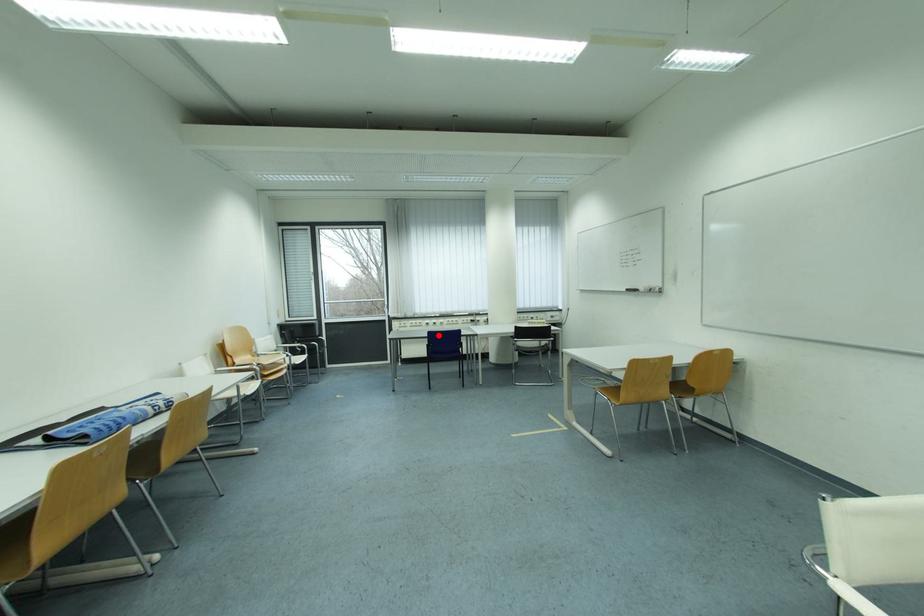
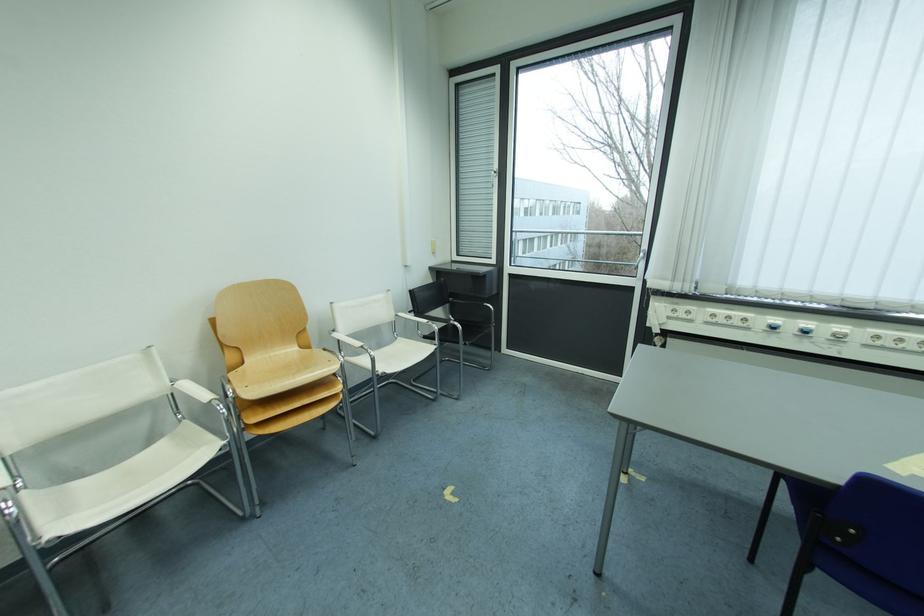
Question: I am providing you with two images of the same scene from different viewpoints. In image1, a red point is highlighted. Considering the same 3D point in image2, which of the following is correct?

Choices:
 (A) It is closer
 (B) It is farther

Answer: (A)